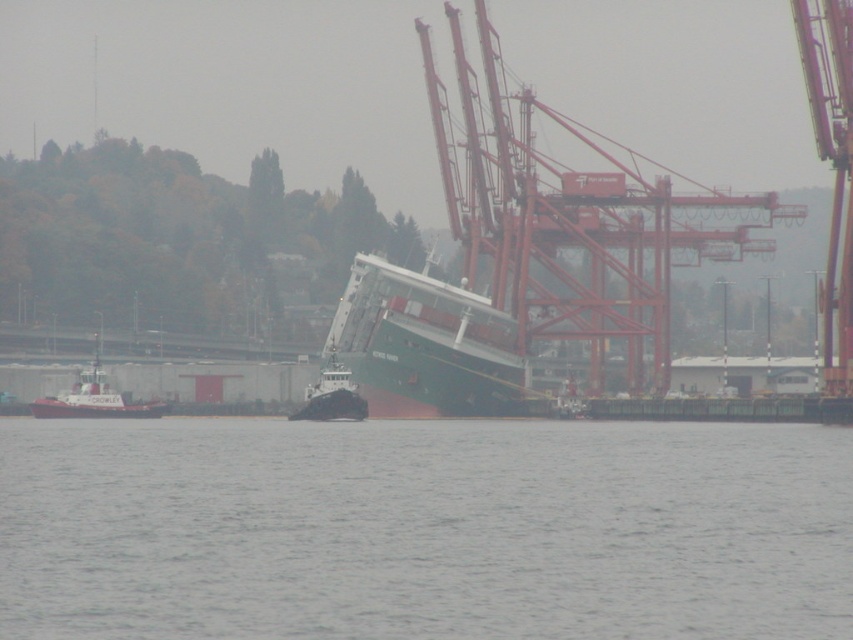
Based on the photo, you are a maritime engineer assessing the tilted ship. You see the gray water at center and the metallic red crane at center. Which object takes up more space in the image?

The metallic red crane at center takes up more space in the image than the gray water at center because the gray water at center has a smaller size compared to the metallic red crane at center.

Based on the photo, you are a maritime engineer assessing the stability of the ship. You notice a point at coordinates (94,397). What object is located at this point?

The point at coordinates (94,397) indicates the brushed metal tugboat at left.